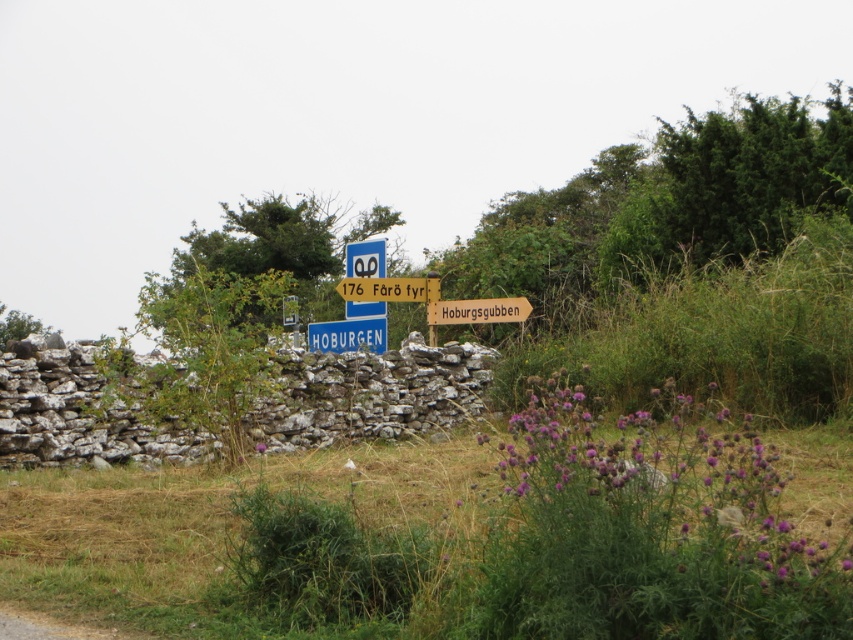
You are a hiker trying to read two road signs in front of you. You see a brown wooden signpost at center and a yellow wooden signpost at center. Which one is on the right side?

The brown wooden signpost at center is positioned on the right side of the yellow wooden signpost at center.

You are a delivery driver trying to read the road signs in front of the stone wall. Which signpost, the brown wooden signpost at center or the yellow wooden signpost at center, has a greater width?

The brown wooden signpost at center might be wider than yellow wooden signpost at center.